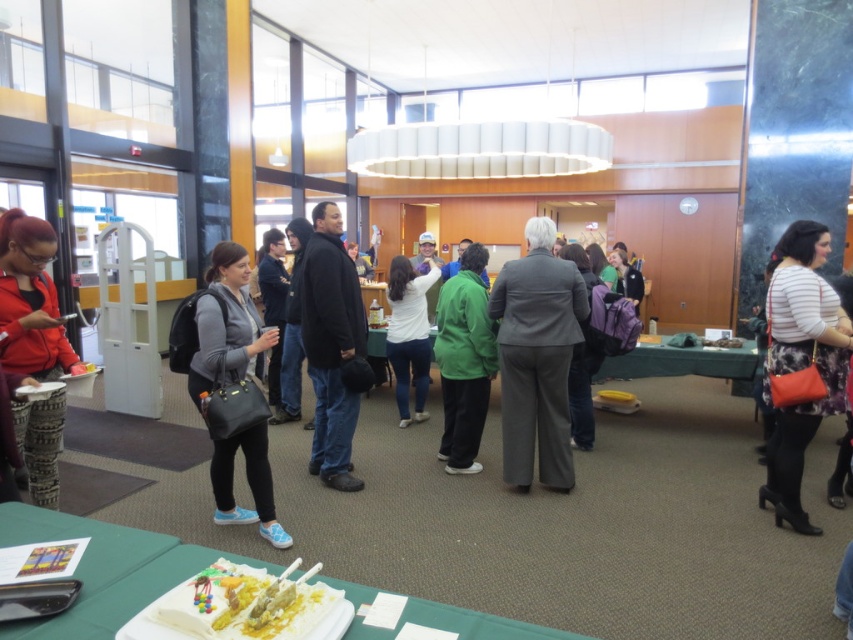
You are an event organizer who needs to retrieve the matte black bag at center from under the gray fabric suit at center. What should you do first?

The gray fabric suit at center is positioned over matte black bag at center, so you should carefully lift the gray fabric suit at center to access the matte black bag at center.